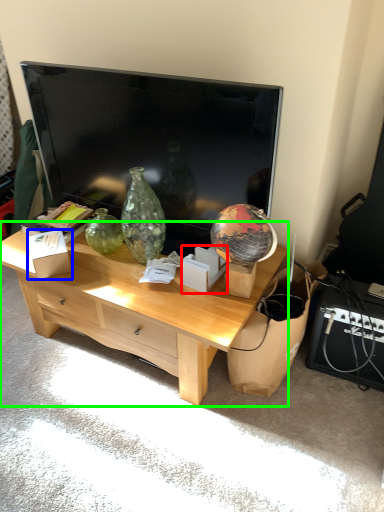
Question: Which object is positioned farthest from cardboard box (highlighted by a red box)? Select from cardboard box (highlighted by a blue box) and desk (highlighted by a green box).

Choices:
 (A) cardboard box
 (B) desk

Answer: (A)